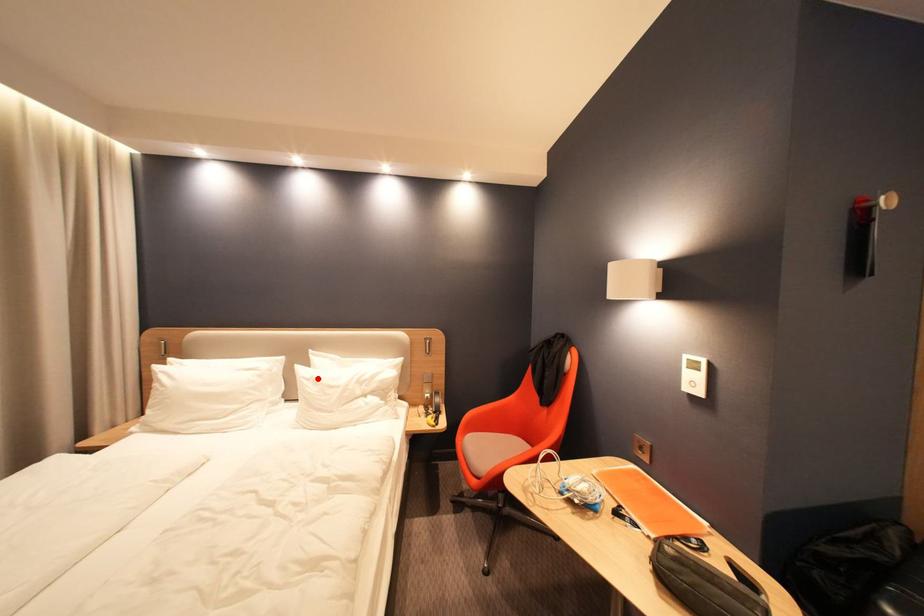
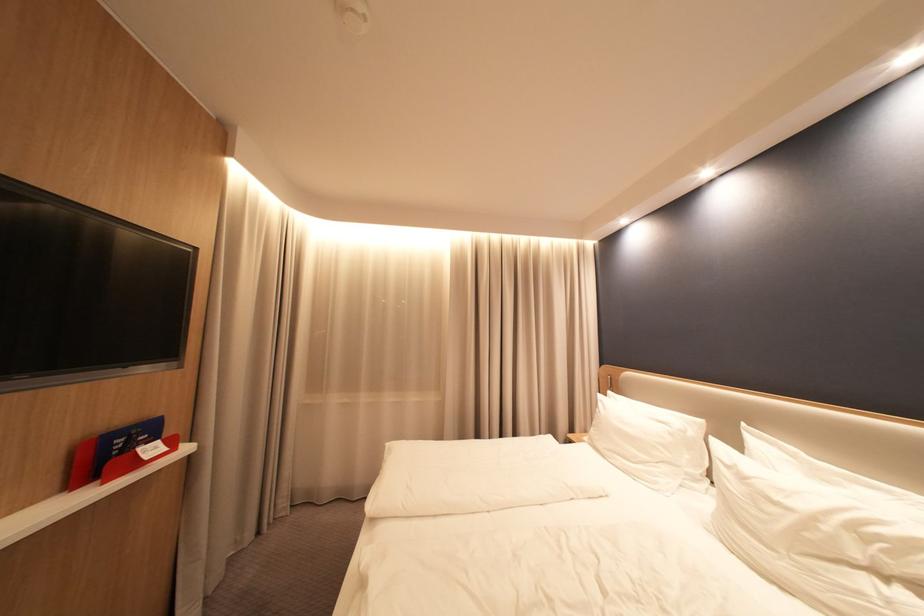
The point at the highlighted location is marked in the first image. Where is the corresponding point in the second image?

(737, 464)